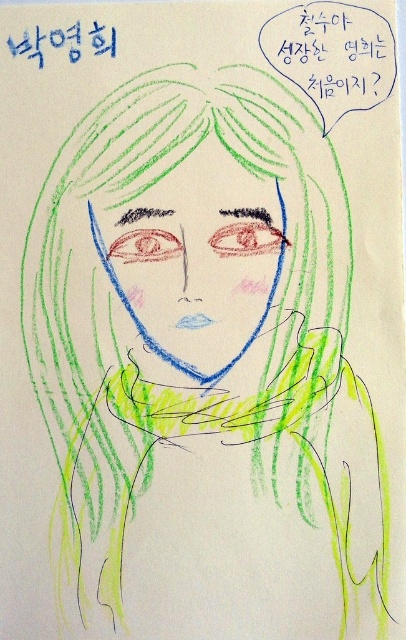
Which is more to the right, black marker name at upper left or reddish-brown eye at center?

reddish-brown eye at center is more to the right.

Describe the element at coordinates (47, 42) in the screenshot. The height and width of the screenshot is (640, 406). I see `black marker name at upper left` at that location.

What do you see at coordinates (47, 42) in the screenshot? Image resolution: width=406 pixels, height=640 pixels. I see `black marker name at upper left` at bounding box center [47, 42].

The image size is (406, 640). In order to click on black marker name at upper left in this screenshot , I will do `click(47, 42)`.

Between black marker name at upper left and red crayon eye at center, which one has less height?

With less height is red crayon eye at center.

Is black marker name at upper left taller than red crayon eye at center?

Yes, black marker name at upper left is taller than red crayon eye at center.

Identify the location of black marker name at upper left. (47, 42).

Is point (278, 241) farther from viewer compared to point (142, 260)?

Yes, it is.

Is reddish-brown eye at center wider than red crayon eye at center?

Yes.

Does point (257, 230) come in front of point (125, 259)?

Yes, point (257, 230) is closer to viewer.

Locate an element on the screen. The width and height of the screenshot is (406, 640). reddish-brown eye at center is located at coordinates (246, 240).